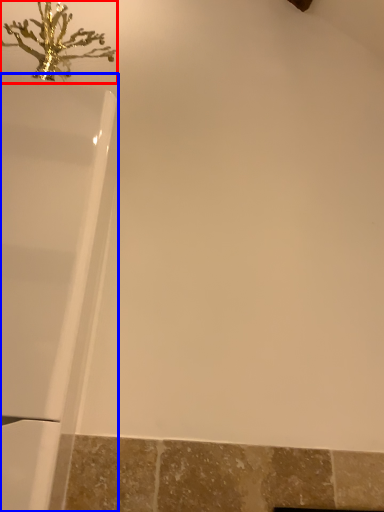
Question: Which point is further to the camera, christmas decoration (highlighted by a red box) or bathtub (highlighted by a blue box)?

Choices:
 (A) christmas decoration
 (B) bathtub

Answer: (A)